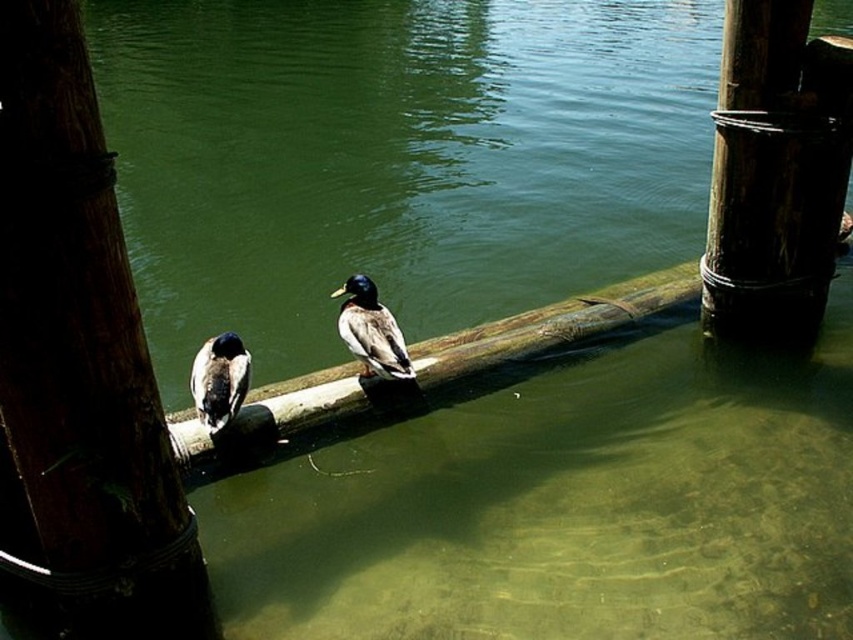
You are a bird watcher standing on the wooden beam and want to observe both the rough wooden pole at center right and the shiny brown duck at left. If your binoculars have a maximum range of 4 meters, can you clearly see both objects with them?

The rough wooden pole at center right and the shiny brown duck at left are 4.31 meters apart from each other. Since the distance between them exceeds the binoculars maximum range of 4 meters, you cannot clearly see both objects simultaneously with the binoculars.

You are a photographer aiming to capture both the rough wooden pole at center right and the shiny brown duck at left in a single frame. Based on their positions, which object is closer to the center of the image?

The rough wooden pole at center right is positioned on the right side of the shiny brown duck at left, so the shiny brown duck at left is closer to the center of the image.

You are a bird trying to land on the wooden beam. There are two poles, the dark brown wood pole at left and the rough wooden pole at center right. Which pole is closer to the left side of the beam?

The dark brown wood pole at left is closer to the left side of the beam since it is positioned to the left of the rough wooden pole at center right.